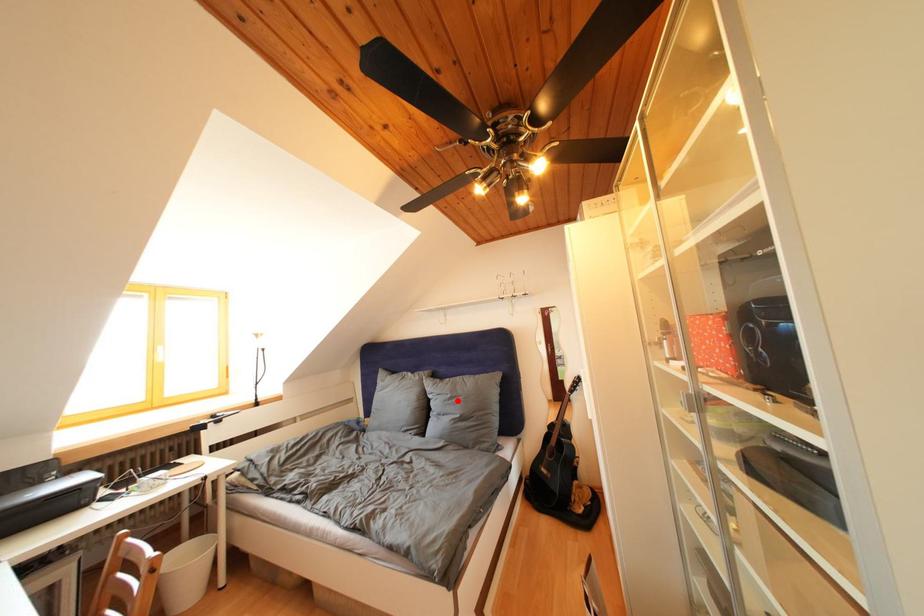
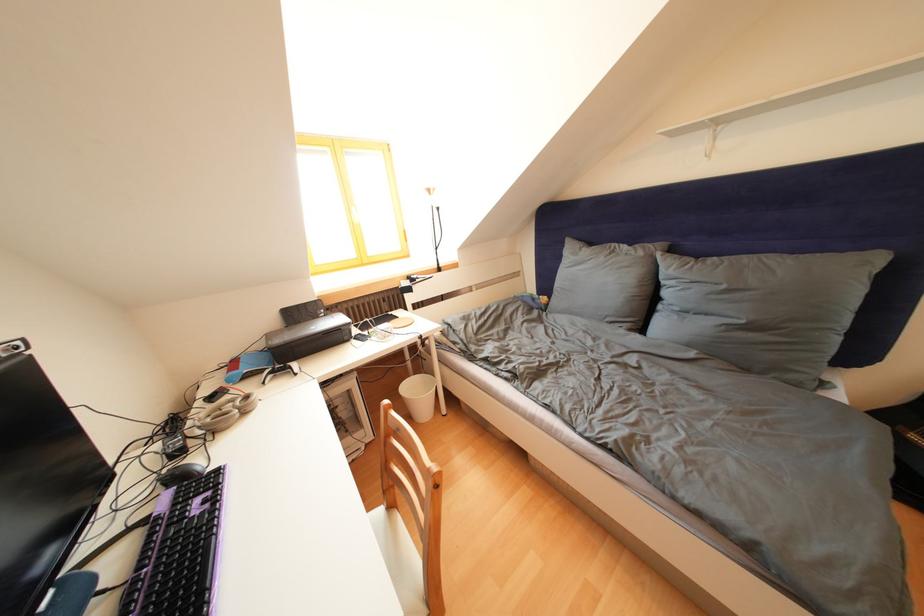
Question: A red point is marked in image1. In image2, is the corresponding 3D point closer to the camera or farther? Reply with the corresponding letter.

Choices:
 (A) The corresponding 3D point is closer.
 (B) The corresponding 3D point is farther.

Answer: (A)